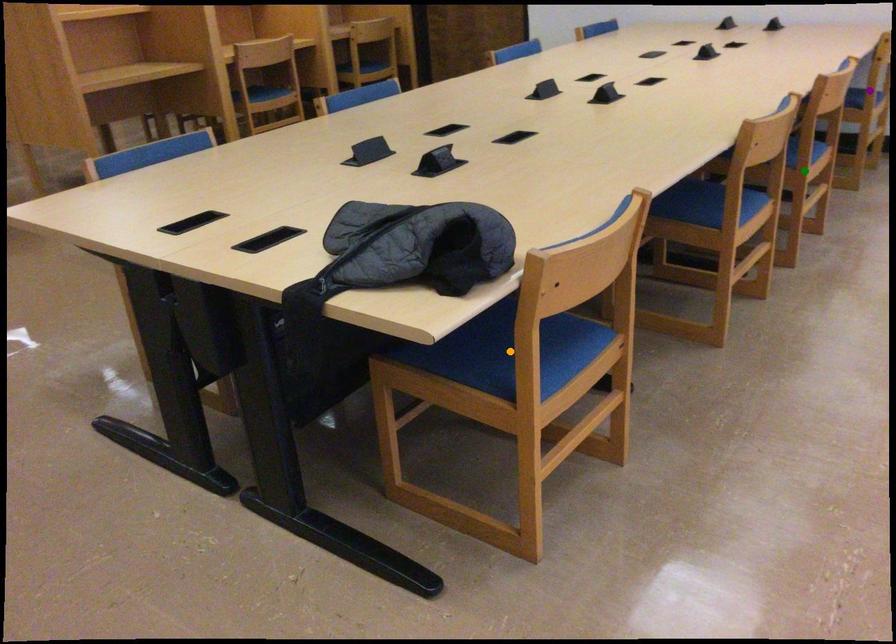
Order these from nearest to farthest:
- orange point
- green point
- purple point

orange point → green point → purple point